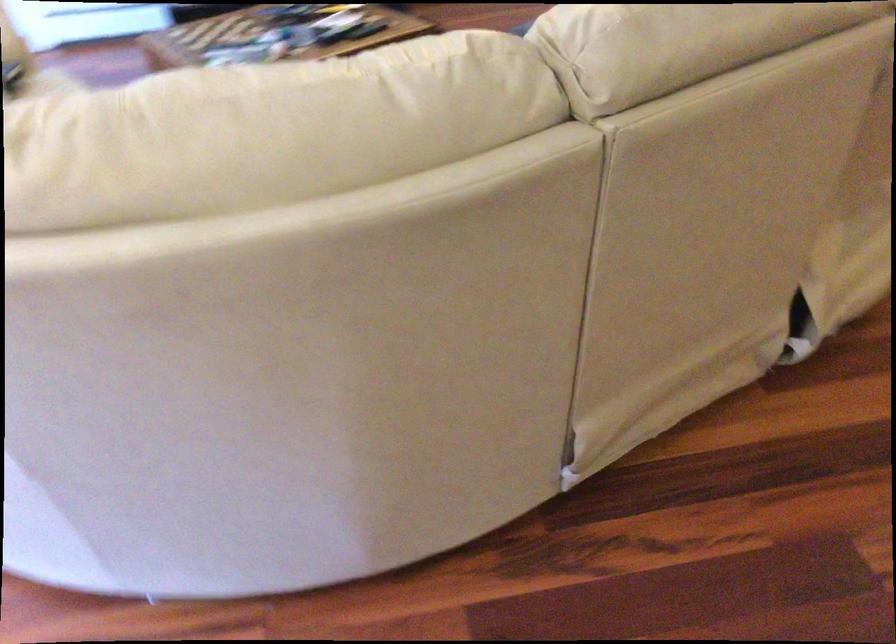
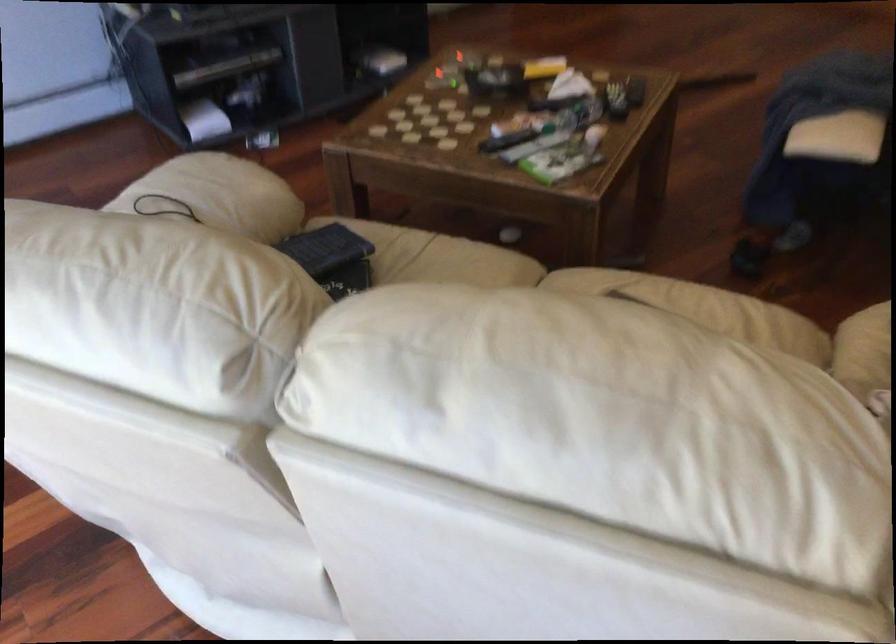
Question: I am providing you with two images of the same scene from different viewpoints. Which of the following objects are not visible in image2?

Choices:
 (A) blue gum pack
 (B) sofa sitting surface
 (C) small black keyboard
 (D) black cable loop

Answer: (B)